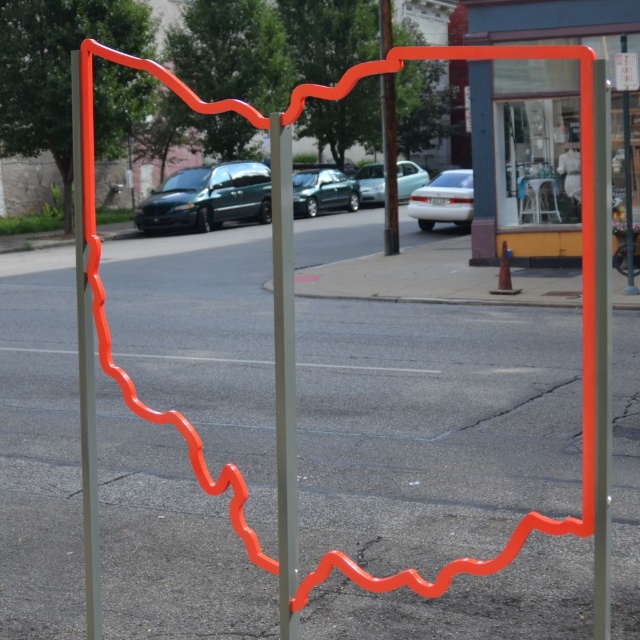
You are a delivery person trying to park your delivery van between the matte orange pole at left and the metallic green car at center. Can your van, which is 2 meters wide, fit in the space between them?

The matte orange pole at left is wider than the metallic green car at center. However, the question is about the space between them, not their widths. Since the description only states the pole is wider than the car, but doesn not provide the actual distance between them, we cannot determine if the van can fit. More information about the distance between the two objects is needed to answer this question accurately.